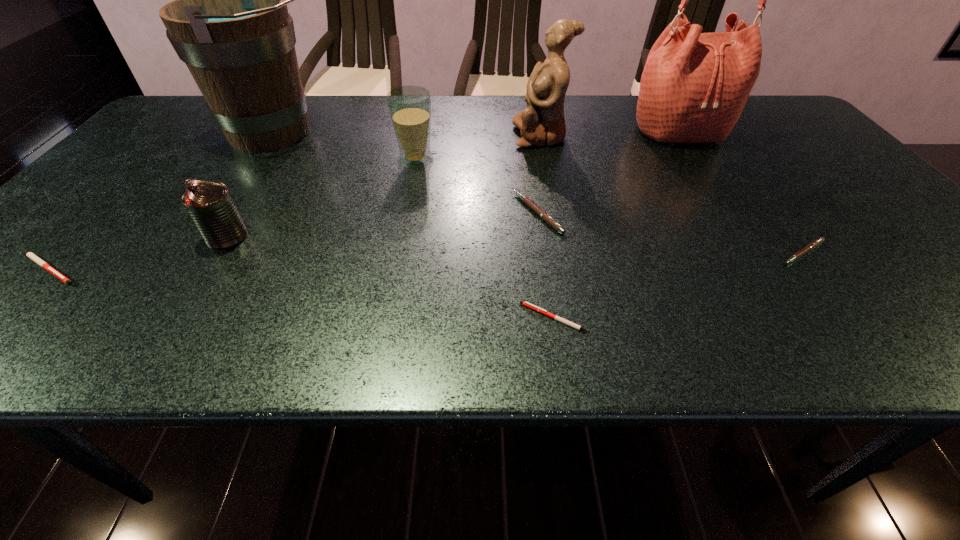
Find the location of a particular element. handbag is located at coordinates (694, 86).

This screenshot has width=960, height=540. In order to click on wine bucket in this screenshot , I will do `click(229, 23)`.

Where is `the seventh shortest object`? This screenshot has width=960, height=540. the seventh shortest object is located at coordinates (542, 123).

You are a GUI agent. You are given a task and a screenshot of the screen. Output one action in this format:
    pyautogui.click(x=<x>, y=<y>)
    Task: Click on the figurine
    This screenshot has height=540, width=960.
    Given the screenshot: What is the action you would take?
    pyautogui.click(x=542, y=123)

Where is `the sixth object from right to left`? the sixth object from right to left is located at coordinates (409, 107).

Find the location of a particular element. The height and width of the screenshot is (540, 960). the sixth shortest object is located at coordinates (409, 107).

Locate an element on the screen. Image resolution: width=960 pixels, height=540 pixels. the fifth tallest object is located at coordinates pyautogui.click(x=210, y=205).

Find the location of a particular element. Image resolution: width=960 pixels, height=540 pixels. the farther pink pen is located at coordinates (547, 218).

Where is `the tallest pen`? The image size is (960, 540). the tallest pen is located at coordinates (547, 218).

At what (x,y) coordinates should I click in order to perform the action: click on the smaller pink pen. Please return your answer as a coordinate pair (x, y). The width and height of the screenshot is (960, 540). Looking at the image, I should click on (815, 243).